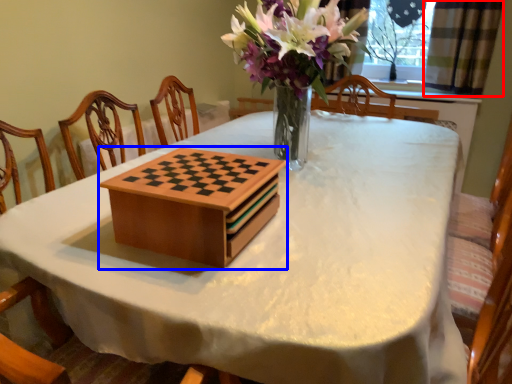
Question: Which point is further to the camera, curtain (highlighted by a red box) or cardboard box (highlighted by a blue box)?

Choices:
 (A) curtain
 (B) cardboard box

Answer: (A)